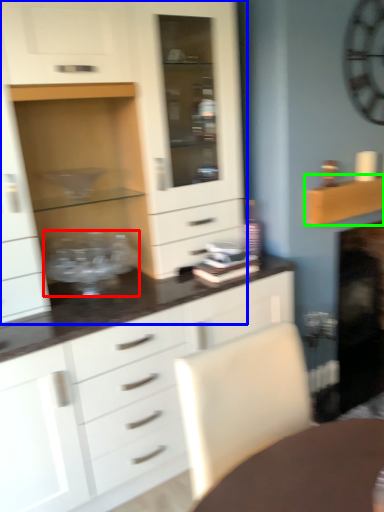
Question: Considering the real-world distances, which object is closest to appliance (highlighted by a red box)? cabinetry (highlighted by a blue box) or shelf (highlighted by a green box).

Choices:
 (A) cabinetry
 (B) shelf

Answer: (A)